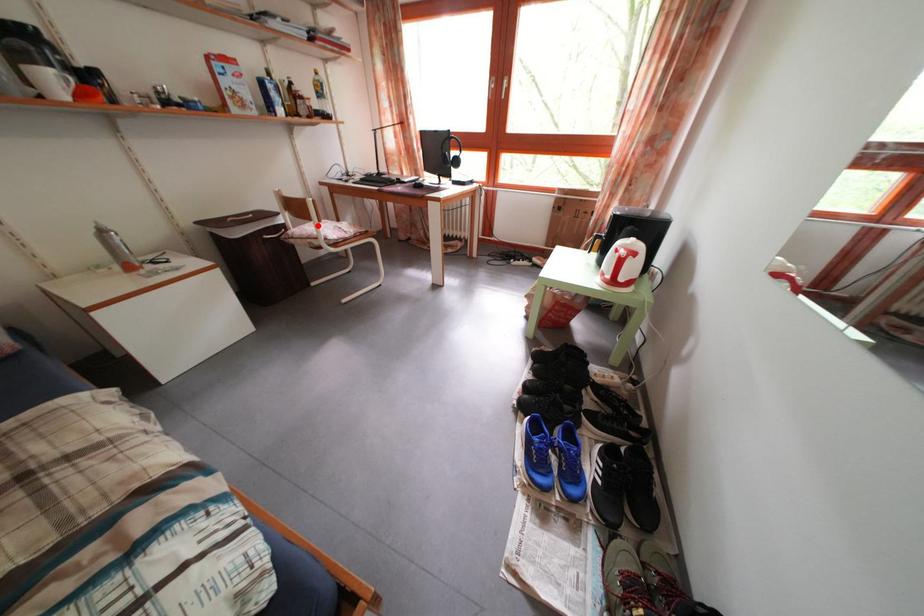
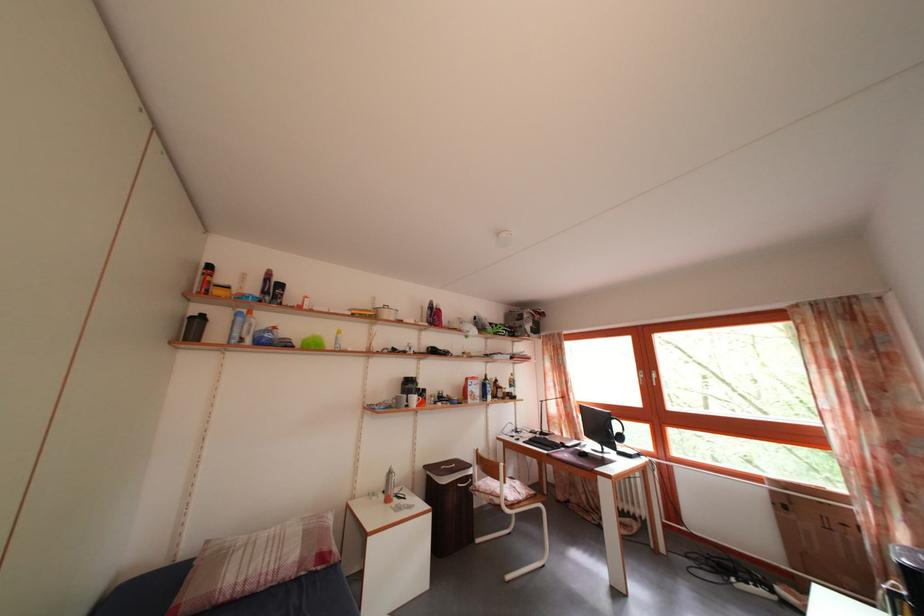
Question: I am providing you with two images of the same scene from different viewpoints. In image1, a red point is highlighted. Considering the same 3D point in image2, which of the following is correct?

Choices:
 (A) It is closer
 (B) It is farther

Answer: (B)